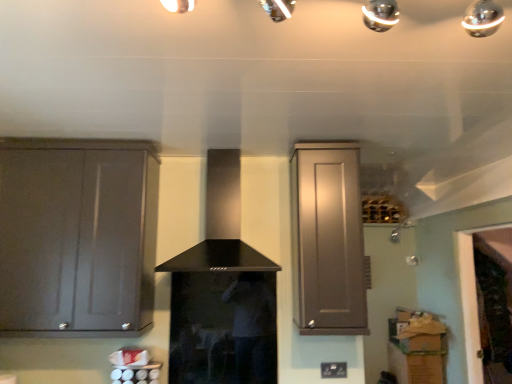
Question: In terms of size, does matte gray cabinet at left, the first cabinetry from the left, appear bigger or smaller than black matte vent at center?

Choices:
 (A) small
 (B) big

Answer: (B)

Question: In the image, is matte gray cabinet at left, the second cabinetry positioned from the right, positioned in front of or behind black matte vent at center?

Choices:
 (A) behind
 (B) front

Answer: (A)

Question: Which is farther from the matte gray cabinet at left, the first cabinetry from the left?

Choices:
 (A) black matte vent at center
 (B) matte gray cabinet at upper right, the 2th cabinetry when ordered from left to right

Answer: (B)

Question: Estimate the real-world distances between objects in this image. Which object is farther from the matte gray cabinet at left, the second cabinetry positioned from the right?

Choices:
 (A) black matte vent at center
 (B) matte gray cabinet at upper right, the 2th cabinetry when ordered from left to right

Answer: (B)